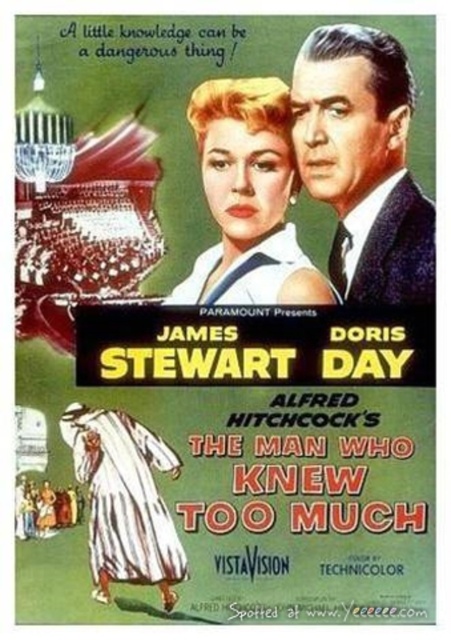
Question: Is smooth black suit at upper right to the right of matte blonde hair at center from the viewer's perspective?

Choices:
 (A) yes
 (B) no

Answer: (A)

Question: Does smooth black suit at upper right appear over matte blonde hair at center?

Choices:
 (A) yes
 (B) no

Answer: (A)

Question: Among these points, which one is nearest to the camera?

Choices:
 (A) (266, 186)
 (B) (403, 198)

Answer: (B)

Question: Does smooth black suit at upper right have a larger size compared to matte blonde hair at center?

Choices:
 (A) no
 (B) yes

Answer: (B)